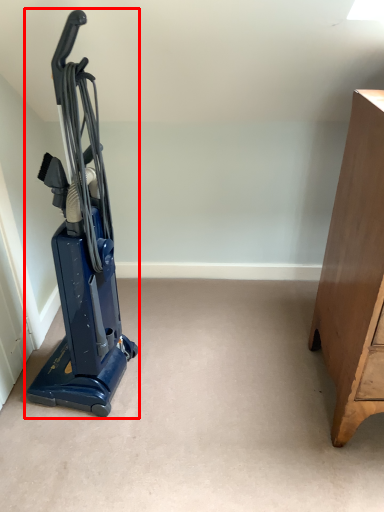
Question: From the image's perspective, considering the relative positions of home appliance (annotated by the red box) and furniture in the image provided, where is home appliance (annotated by the red box) located with respect to the staircase?

Choices:
 (A) below
 (B) above

Answer: (B)